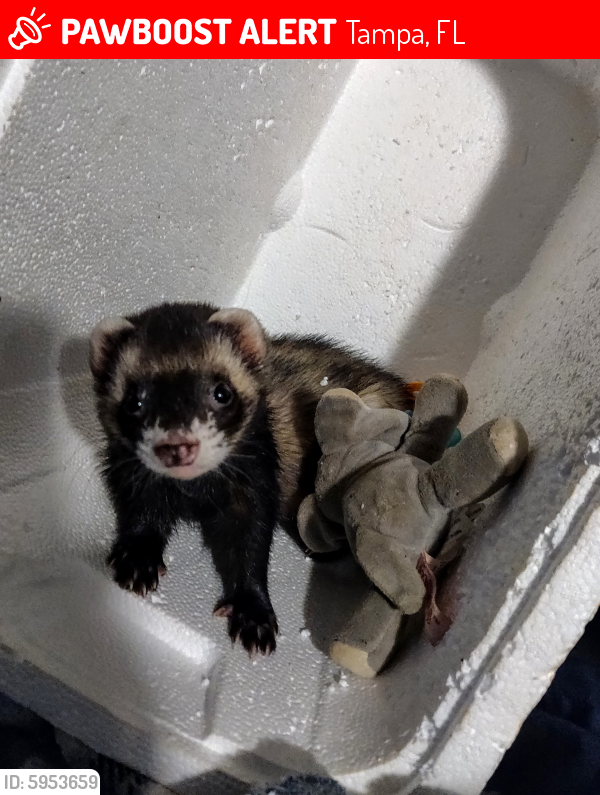
Find the location of a particular element. The width and height of the screenshot is (600, 795). toy is located at coordinates (367, 490).